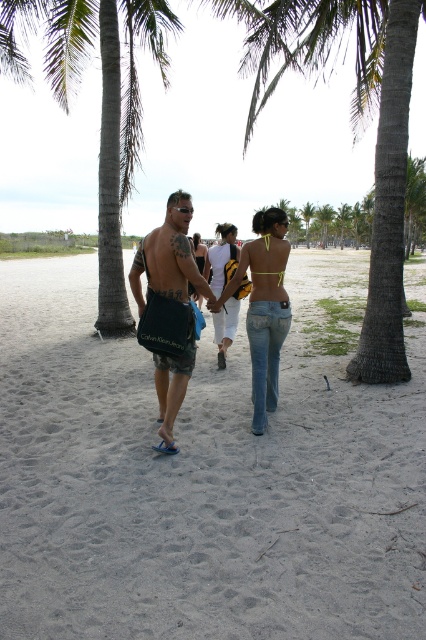
Question: Which object is farther from the camera taking this photo?

Choices:
 (A) denim shorts at center
 (B) gray sand at center

Answer: (A)

Question: Can you confirm if denim jeans at center is thinner than white cotton tank top at center?

Choices:
 (A) no
 (B) yes

Answer: (A)

Question: Can you confirm if gray sand at center is positioned to the right of denim shorts at center?

Choices:
 (A) no
 (B) yes

Answer: (B)

Question: Can you confirm if gray sand at center is positioned to the right of denim jeans at center?

Choices:
 (A) yes
 (B) no

Answer: (A)

Question: Which of the following is the closest to the observer?

Choices:
 (A) (222, 230)
 (B) (267, 266)
 (C) (282, 276)

Answer: (B)

Question: Which of these objects is positioned closest to the gray textured trunk at right?

Choices:
 (A) gray sand at center
 (B) white cotton tank top at center

Answer: (A)